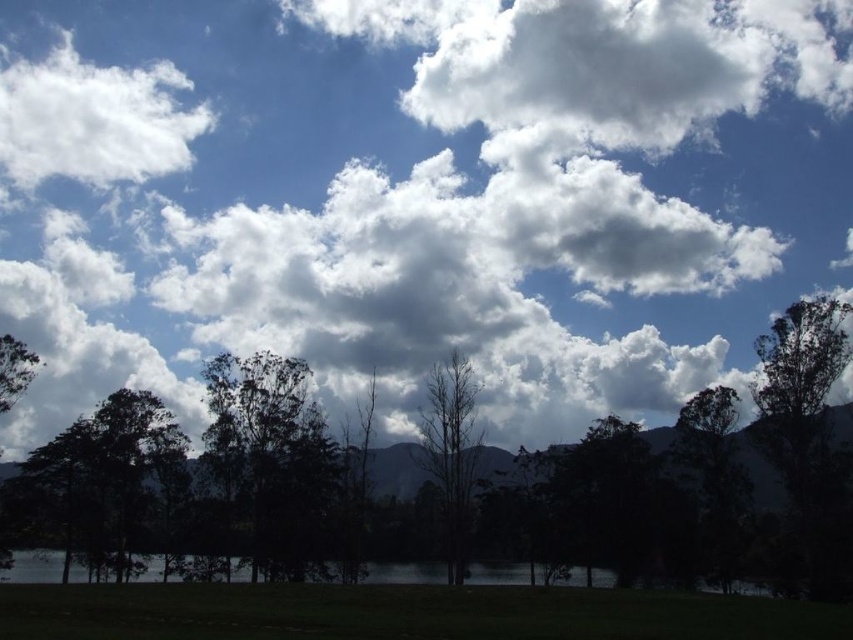
Question: Which of these objects is positioned closest to the bare wood tree at center?

Choices:
 (A) white fluffy clouds at upper center
 (B) dark green leafy tree at center

Answer: (B)

Question: Is white fluffy clouds at upper center below dark green leafy tree at center?

Choices:
 (A) no
 (B) yes

Answer: (A)

Question: Which object is positioned closest to the dark green leafy tree at center?

Choices:
 (A) green leafy tree at center
 (B) bare wood tree at center
 (C) white fluffy clouds at upper center
 (D) white fluffy cloud at upper left

Answer: (A)

Question: Does white fluffy clouds at upper center appear under dark green leafy tree at center?

Choices:
 (A) no
 (B) yes

Answer: (A)

Question: Does white fluffy clouds at upper center come behind green leafy tree at center?

Choices:
 (A) no
 (B) yes

Answer: (B)

Question: Which point is farther to the camera?

Choices:
 (A) green leafy tree at center
 (B) bare wood tree at center
 (C) dark green leafy tree at center

Answer: (C)